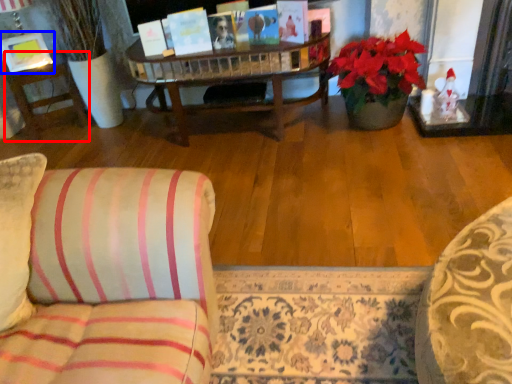
Question: Which of the following is the closest to the observer, side table (highlighted by a red box) or picture frame (highlighted by a blue box)?

Choices:
 (A) side table
 (B) picture frame

Answer: (B)